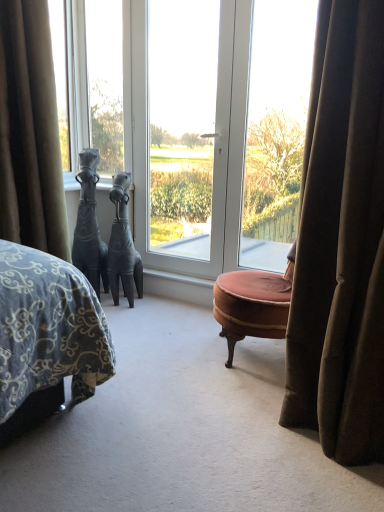
You are a GUI agent. You are given a task and a screenshot of the screen. Output one action in this format:
    pyautogui.click(x=<x>, y=<y>)
    Task: Click on the free space in front of velvet brown ottoman at center
    
    Given the screenshot: What is the action you would take?
    pyautogui.click(x=234, y=402)